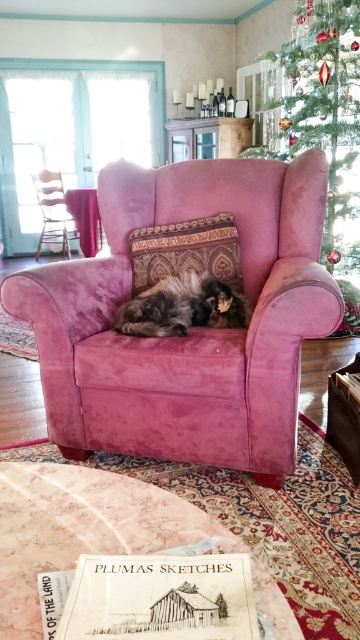
You are a delivery robot with a package that measures 1.5 meters in length. You need to navigate through the living room to deliver it to the teal door. The path between the velvet pink armchair at center and the green velvet christmas tree at upper right is the only route available. Will your package fit through this path without bending or damaging it?

The velvet pink armchair at center is 1.49 meters away from the green velvet christmas tree at upper right. Since the package is 1.5 meters long, it is slightly longer than the available space between the two objects. Therefore, the package will not fit through the path without bending or damaging it.

You are standing in the room and want to locate the point at coordinates (192, 330). According to the scene description, where exactly would this point be located?

The point at coordinates (192, 330) is located on the velvet pink armchair at center.